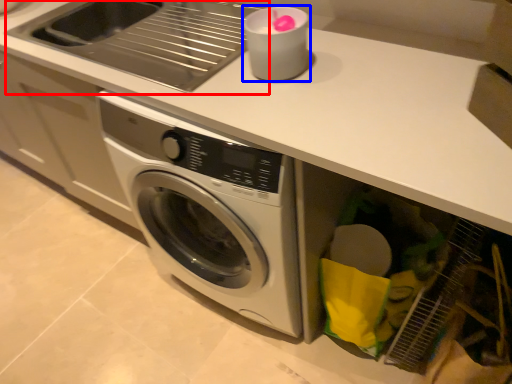
Question: Which object is further to the camera taking this photo, sink (highlighted by a red box) or appliance (highlighted by a blue box)?

Choices:
 (A) sink
 (B) appliance

Answer: (A)